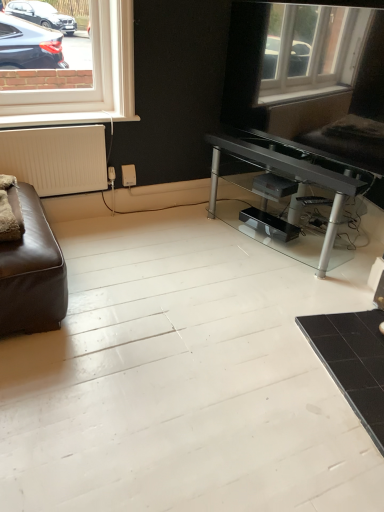
The height and width of the screenshot is (512, 384). Identify the location of empty space that is ontop of black matte table at lower right (from a real-world perspective). (366, 345).